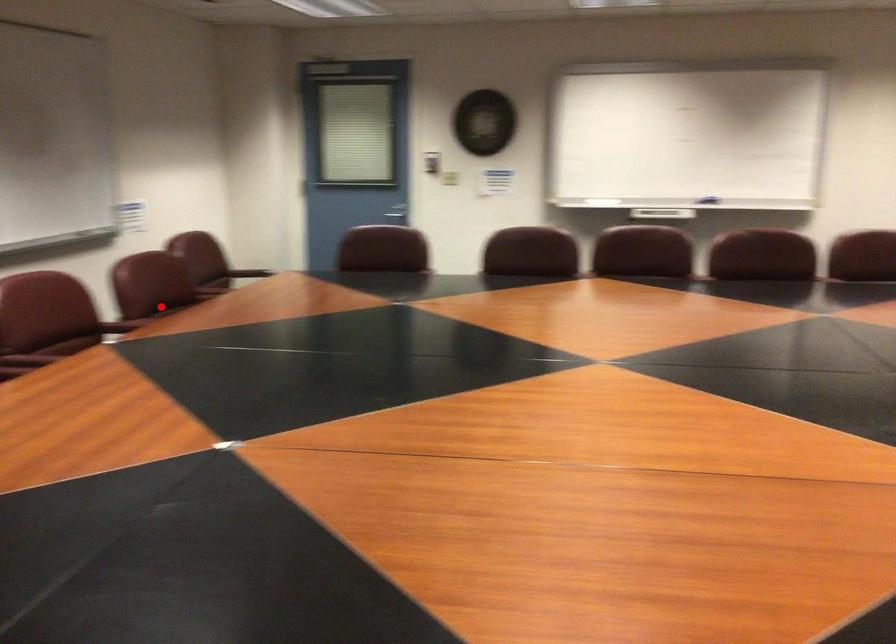
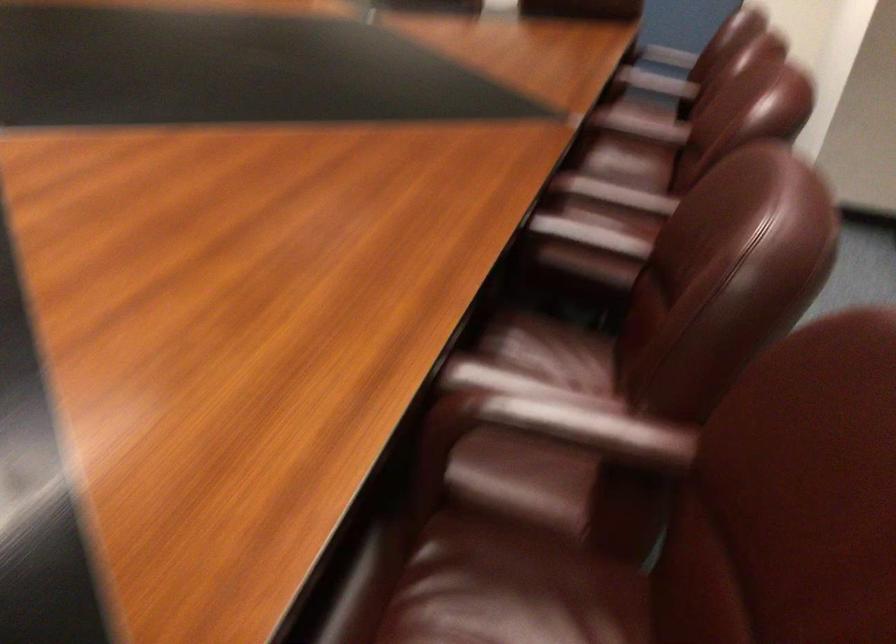
Question: I am providing you with two images of the same scene from different viewpoints. A red point is shown in image1. For the corresponding object point in image2, is it positioned nearer or farther from the camera?

Choices:
 (A) Nearer
 (B) Farther

Answer: (A)